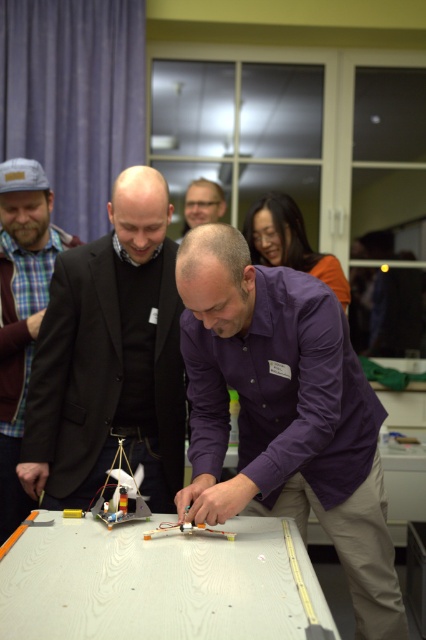
Question: Which point is closer to the camera taking this photo?

Choices:
 (A) (192, 209)
 (B) (363, 449)
 (C) (28, 541)

Answer: (C)

Question: Is white wood table at center closer to camera compared to matte black glasses at upper center?

Choices:
 (A) no
 (B) yes

Answer: (B)

Question: Can you confirm if black matte suit at center is bigger than plaid fabric shirt at left?

Choices:
 (A) no
 (B) yes

Answer: (B)

Question: Is black matte suit at center wider than plaid fabric shirt at left?

Choices:
 (A) yes
 (B) no

Answer: (A)

Question: Which point is closer to the camera?

Choices:
 (A) black matte suit at center
 (B) matte black glasses at upper center
 (C) white wood table at center
 (D) purple cotton shirt at center

Answer: (C)

Question: Which point is closer to the camera?

Choices:
 (A) (51, 346)
 (B) (279, 634)
 (C) (212, 214)
 (D) (31, 285)

Answer: (B)